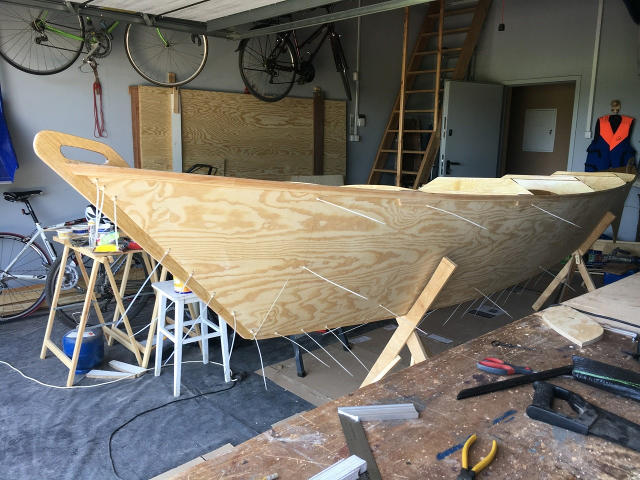
Locate an element on the screen. The image size is (640, 480). garage wall is located at coordinates (547, 55).